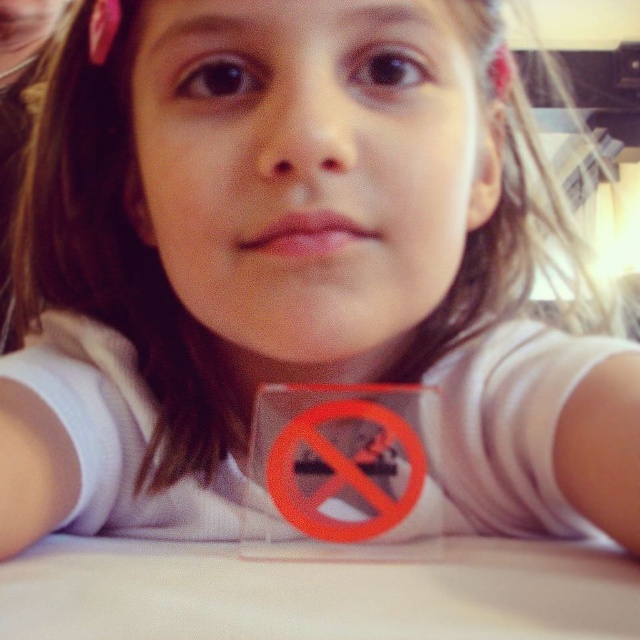
Is point (388, 632) farther from camera compared to point (340, 529)?

No, it is not.

Who is more distant from viewer, [84,560] or [342,513]?

The point [342,513] is more distant.

Identify the location of white matte table at center. The image size is (640, 640). (317, 589).